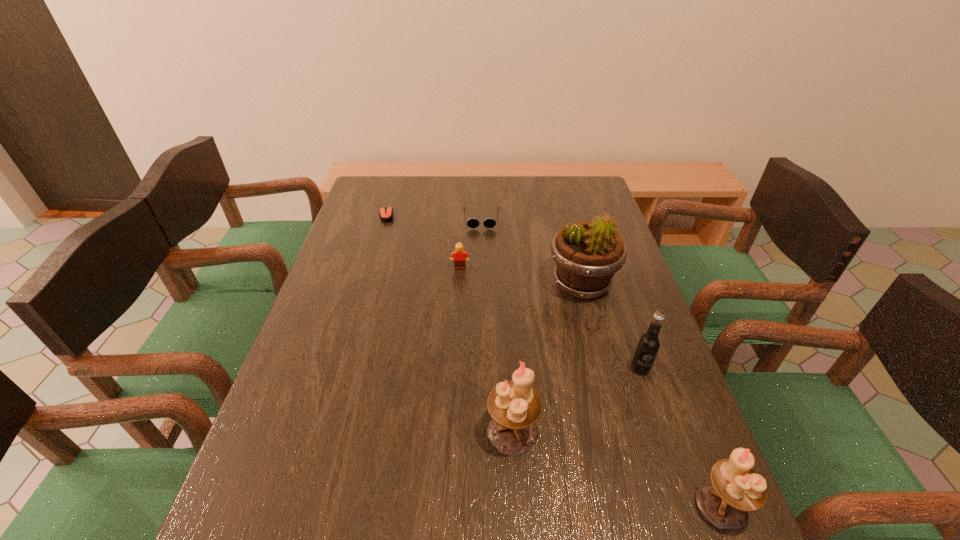
Locate an element on the screen. blank space at the far left corner is located at coordinates (398, 185).

Image resolution: width=960 pixels, height=540 pixels. Find the location of `vacant space at the near left corner of the desktop`. vacant space at the near left corner of the desktop is located at coordinates (267, 482).

In the image, there is a desktop. At what (x,y) coordinates should I click in order to perform the action: click on vacant region at the far right corner. Please return your answer as a coordinate pair (x, y). Image resolution: width=960 pixels, height=540 pixels. Looking at the image, I should click on (582, 205).

Locate an element on the screen. This screenshot has width=960, height=540. free space at the near right corner of the desktop is located at coordinates pos(660,499).

This screenshot has width=960, height=540. Identify the location of free area in between the third shortest object and the sixth farthest object. (486, 350).

Where is `vacant space that's between the Lego and the third nearest object`? The image size is (960, 540). vacant space that's between the Lego and the third nearest object is located at coordinates (550, 319).

I want to click on free spot between the sunglasses and the third shortest object, so click(x=470, y=244).

Where is `free spot between the taller candle holder and the tallest object`? The image size is (960, 540). free spot between the taller candle holder and the tallest object is located at coordinates (547, 358).

Find the location of a particular element. blank region between the computer mouse and the taller candle holder is located at coordinates (449, 324).

Where is `free spot between the computer mouse and the left candle holder`? free spot between the computer mouse and the left candle holder is located at coordinates (449, 324).